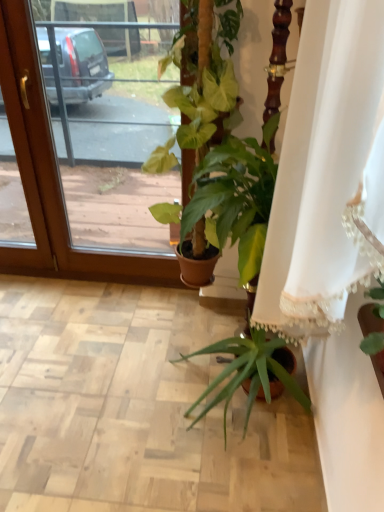
Measure the distance between green glossy plant at center and camera.

They are 3.63 feet apart.

What do you see at coordinates (52, 174) in the screenshot? I see `transparent glass screen door at upper left` at bounding box center [52, 174].

At what (x,y) coordinates should I click in order to perform the action: click on green glossy plant at center. Please return your answer as a coordinate pair (x, y). Image resolution: width=384 pixels, height=512 pixels. Looking at the image, I should click on (200, 81).

How distant is white lace curtain at center from transparent glass screen door at upper left?

They are 1.49 meters apart.

Which is behind, white lace curtain at center or transparent glass screen door at upper left?

transparent glass screen door at upper left is behind.

Considering the relative sizes of white lace curtain at center and transparent glass screen door at upper left in the image provided, is white lace curtain at center smaller than transparent glass screen door at upper left?

No.

Considering the positions of point (339, 109) and point (42, 89), is point (339, 109) closer or farther from the camera than point (42, 89)?

Point (339, 109) is positioned closer to the camera compared to point (42, 89).

Is transparent glass screen door at upper left placed right next to green glossy plant at center?

No.

Does transparent glass screen door at upper left have a smaller size compared to green glossy plant at center?

Incorrect, transparent glass screen door at upper left is not smaller in size than green glossy plant at center.

Between transparent glass screen door at upper left and green glossy plant at center, which one is positioned behind?

transparent glass screen door at upper left is further away from the camera.

Looking at this image, is transparent glass screen door at upper left a part of green glossy plant at center?

No.

Looking at this image, is green glossy plant at center taller or shorter than transparent glass screen door at upper left?

Considering their sizes, green glossy plant at center has less height than transparent glass screen door at upper left.

From the picture: From a real-world perspective, is green glossy plant at center located beneath transparent glass screen door at upper left?

No, from a real-world perspective, green glossy plant at center is not under transparent glass screen door at upper left.

Is point (342, 23) closer to camera compared to point (204, 141)?

Yes, it is.

Would you say white lace curtain at center is outside green glossy plant at center?

Indeed, white lace curtain at center is completely outside green glossy plant at center.

Between white lace curtain at center and green glossy plant at center, which one has larger width?

white lace curtain at center is wider.

Considering the positions of objects white lace curtain at center and green glossy plant at center in the image provided, who is behind, white lace curtain at center or green glossy plant at center?

green glossy plant at center is more distant.

From the image's perspective, is green glossy plant at center below white lace curtain at center?

Actually, green glossy plant at center appears above white lace curtain at center in the image.

Looking at their sizes, would you say green glossy plant at center is wider or thinner than white lace curtain at center?

Considering their sizes, green glossy plant at center looks slimmer than white lace curtain at center.

Looking at this image, from a real-world perspective, between green glossy plant at center and white lace curtain at center, who is vertically lower?

green glossy plant at center, from a real-world perspective.

Is point (199, 68) positioned behind point (334, 9)?

Yes, point (199, 68) is farther from viewer.

What's the angular difference between transparent glass screen door at upper left and white lace curtain at center's facing directions?

The angle between the facing direction of transparent glass screen door at upper left and the facing direction of white lace curtain at center is 87.9 degrees.

Is transparent glass screen door at upper left looking in the opposite direction of white lace curtain at center?

No, transparent glass screen door at upper left is not facing away from white lace curtain at center.

From the image's perspective, between transparent glass screen door at upper left and white lace curtain at center, which one is located above?

transparent glass screen door at upper left appears higher in the image.

Considering the sizes of objects transparent glass screen door at upper left and white lace curtain at center in the image provided, who is thinner, transparent glass screen door at upper left or white lace curtain at center?

Thinner between the two is transparent glass screen door at upper left.

I want to click on curtain on the right of the transparent glass screen door at upper left, so pos(322,170).

This screenshot has height=512, width=384. In order to click on houseplant located above the transparent glass screen door at upper left (from a real-world perspective) in this screenshot , I will do `click(200, 81)`.

Considering their positions, is white lace curtain at center positioned further to transparent glass screen door at upper left than green glossy plant at center?

white lace curtain at center is positioned further to the anchor transparent glass screen door at upper left.

When comparing their distances from green glossy plant at center, does transparent glass screen door at upper left or white lace curtain at center seem closer?

Based on the image, white lace curtain at center appears to be nearer to green glossy plant at center.

Considering their positions, is transparent glass screen door at upper left positioned closer to white lace curtain at center than green glossy plant at center?

green glossy plant at center is closer to white lace curtain at center.

Estimate the real-world distances between objects in this image. Which object is further from white lace curtain at center, green glossy plant at center or transparent glass screen door at upper left?

The object further to white lace curtain at center is transparent glass screen door at upper left.

Looking at the image, which one is located closer to transparent glass screen door at upper left, green glossy plant at center or white lace curtain at center?

green glossy plant at center lies closer to transparent glass screen door at upper left than the other object.

From the image, which object appears to be farther from green glossy plant at center, white lace curtain at center or transparent glass screen door at upper left?

transparent glass screen door at upper left.

Image resolution: width=384 pixels, height=512 pixels. I want to click on houseplant located between white lace curtain at center and transparent glass screen door at upper left in the depth direction, so click(x=200, y=81).